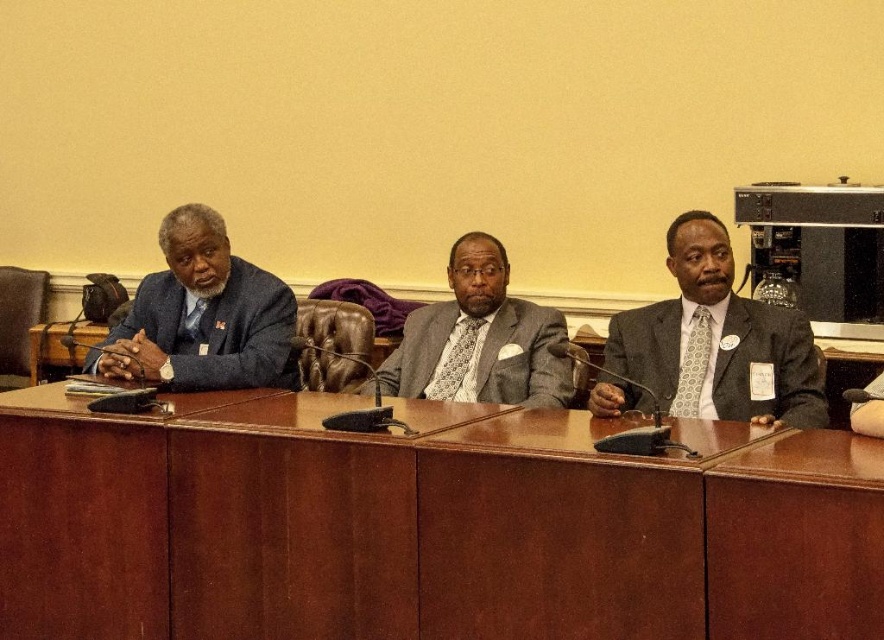
You are organizing a small meeting and need to place a 1.5 meter long laptop on the table. Given that the brown wood table at center is larger than the matte black suit at left, will the table have enough space for the laptop?

The brown wood table at center is larger in size than the matte black suit at left. Since the table is larger, it should have sufficient space to accommodate a 1.5 meter long laptop.

You are standing in the conference room and need to place a small plant between the two points, point (10, 624) and point (657, 392). According to their positions, where should the plant be placed so it is equidistant from both points?

The plant should be placed at the midpoint between point (10, 624) and point (657, 392). To find the midpoint, calculate the average of the x and y coordinates. The midpoint would be at x coordinate 0.794 and y coordinate 0.378, so the plant should be placed at point 0.794, 0.378.